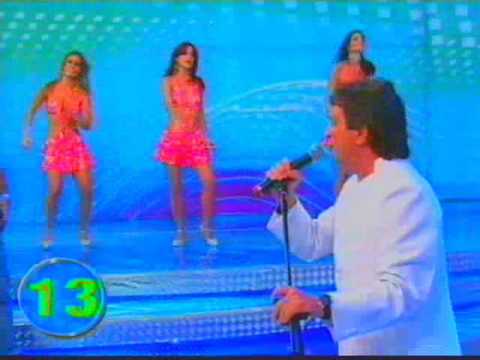
Find the location of a particular element. The height and width of the screenshot is (360, 480). stage is located at coordinates 134,265.